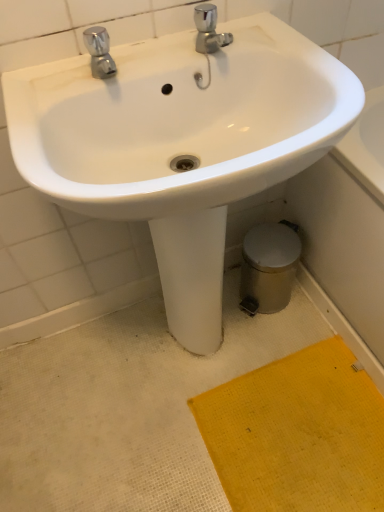
Locate an element on the screen. spots to the right of polished chrome faucet at upper left is located at coordinates (164, 63).